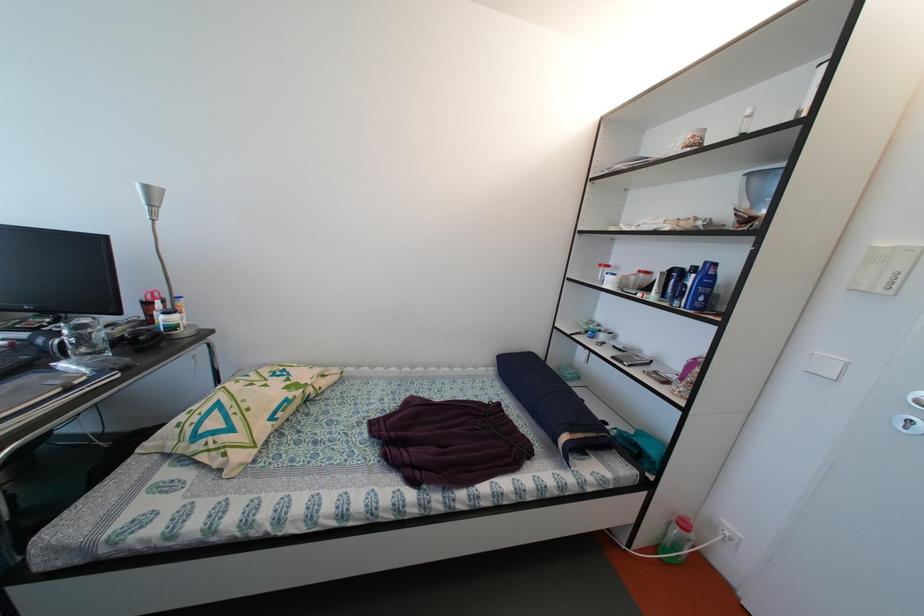
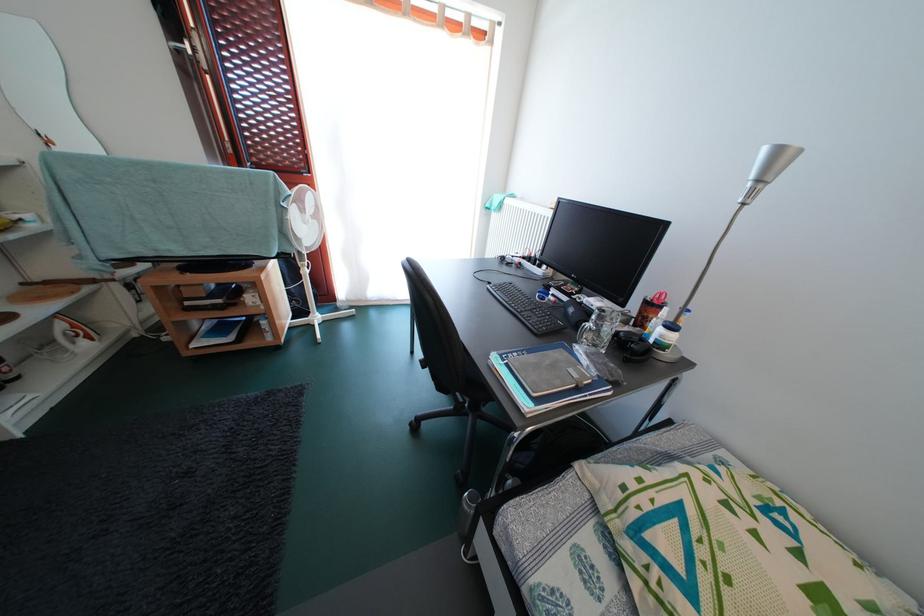
How did the camera likely rotate?

The rotation direction of the camera is left-down.